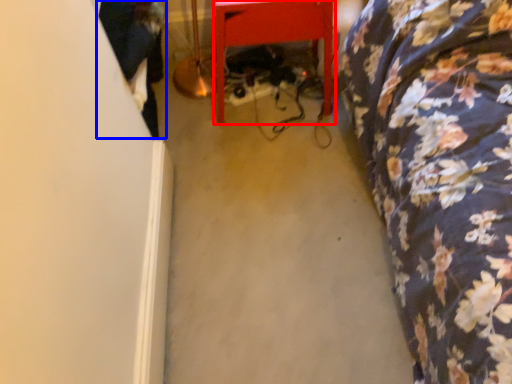
Question: Which of the following is the farthest to the observer, furniture (highlighted by a red box) or couple (highlighted by a blue box)?

Choices:
 (A) furniture
 (B) couple

Answer: (B)